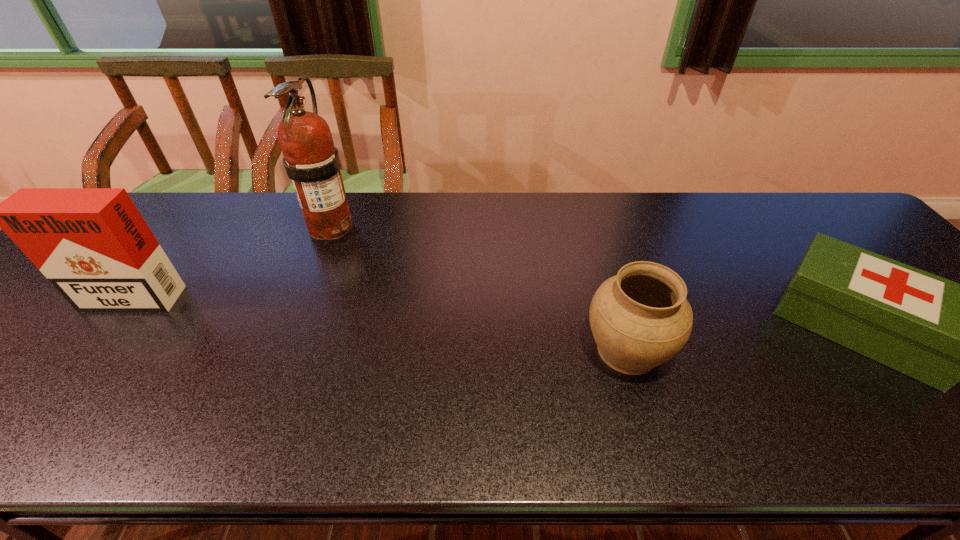
Identify the location of object positioned at the left edge. The image size is (960, 540). (93, 245).

The width and height of the screenshot is (960, 540). In the image, there is a desktop. In order to click on vacant region at the far edge in this screenshot , I will do `click(434, 218)`.

Where is `free location at the near edge`? free location at the near edge is located at coordinates (258, 418).

Find the location of a particular element. The image size is (960, 540). free space at the left edge of the desktop is located at coordinates (35, 298).

Find the location of a particular element. This screenshot has height=540, width=960. vacant area at the far right corner is located at coordinates (825, 196).

This screenshot has height=540, width=960. In order to click on unoccupied position between the third tallest object and the tallest object in this screenshot , I will do `click(479, 288)`.

The image size is (960, 540). Find the location of `free area in between the urn and the fire extinguisher`. free area in between the urn and the fire extinguisher is located at coordinates (479, 288).

Select which object appears as the closest to the cigarette case. Please provide its 2D coordinates. Your answer should be formatted as a tuple, i.e. [(x, y)], where the tuple contains the x and y coordinates of a point satisfying the conditions above.

[(312, 162)]

Locate which object ranks in proximity to the tallest object. Please provide its 2D coordinates. Your answer should be formatted as a tuple, i.e. [(x, y)], where the tuple contains the x and y coordinates of a point satisfying the conditions above.

[(93, 245)]

The height and width of the screenshot is (540, 960). What are the coordinates of `free space that satisfies the following two spatial constraints: 1. on the front-facing side of the third tallest object; 2. on the right side of the third shortest object` in the screenshot? It's located at (82, 350).